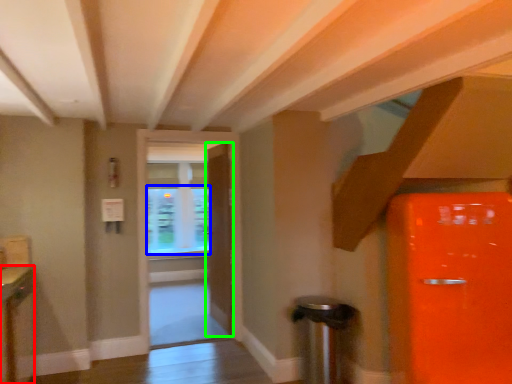
Question: Which object is the closest to the cabinetry (highlighted by a red box)? Choose among these: window screen (highlighted by a blue box) or door (highlighted by a green box).

Choices:
 (A) window screen
 (B) door

Answer: (B)